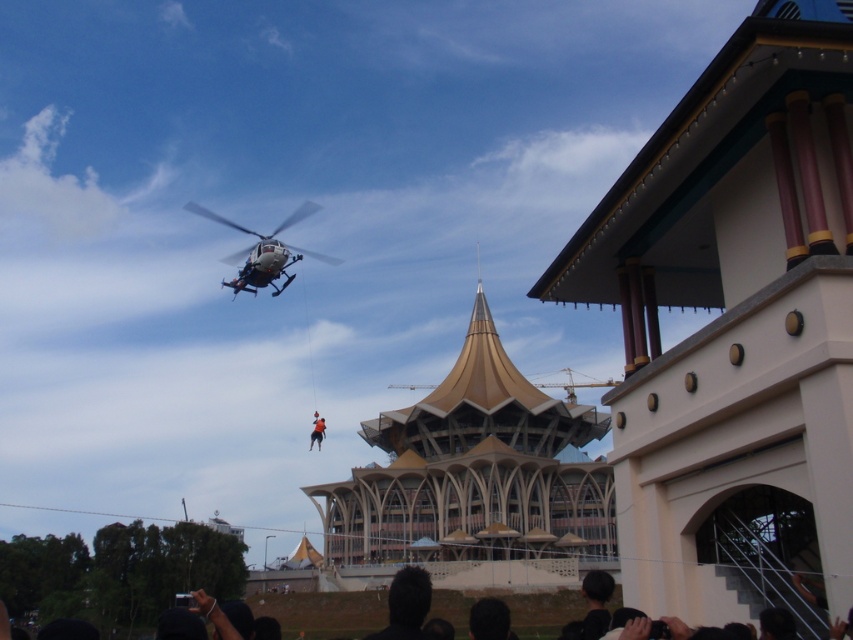
How much distance is there between white painted stone temple at upper right and black hair at lower center?

white painted stone temple at upper right and black hair at lower center are 30.04 meters apart.

Between white painted stone temple at upper right and black hair at lower center, which one has less height?

white painted stone temple at upper right

What do you see at coordinates (735, 326) in the screenshot?
I see `white painted stone temple at upper right` at bounding box center [735, 326].

Locate an element on the screen. This screenshot has height=640, width=853. white painted stone temple at upper right is located at coordinates (735, 326).

Can you confirm if white painted stone temple at upper right is shorter than white matte helicopter at upper center?

Incorrect, white painted stone temple at upper right's height does not fall short of white matte helicopter at upper center's.

Looking at this image, is white painted stone temple at upper right closer to the viewer compared to white matte helicopter at upper center?

Yes, it is in front of white matte helicopter at upper center.

Measure the distance between white painted stone temple at upper right and camera.

white painted stone temple at upper right is 79.38 feet from camera.

Find the location of a particular element. white painted stone temple at upper right is located at coordinates (735, 326).

What do you see at coordinates (473, 483) in the screenshot? I see `beige concrete temple at center` at bounding box center [473, 483].

Does point (355, 576) lie behind point (509, 592)?

That is True.

Does point (509, 445) come closer to viewer compared to point (308, 620)?

No, (509, 445) is further to viewer.

Find the location of `beige concrete temple at center`. beige concrete temple at center is located at coordinates (473, 483).